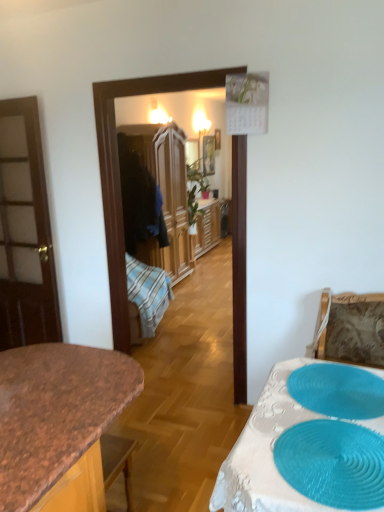
Question: Can you confirm if wooden wardrobe at center is smaller than granite countertop at center?

Choices:
 (A) yes
 (B) no

Answer: (B)

Question: From the image's perspective, would you say wooden wardrobe at center is shown under granite countertop at center?

Choices:
 (A) no
 (B) yes

Answer: (A)

Question: Does wooden wardrobe at center have a greater height compared to granite countertop at center?

Choices:
 (A) yes
 (B) no

Answer: (A)

Question: Considering the relative sizes of wooden wardrobe at center and granite countertop at center in the image provided, is wooden wardrobe at center thinner than granite countertop at center?

Choices:
 (A) yes
 (B) no

Answer: (A)

Question: Is wooden wardrobe at center behind granite countertop at center?

Choices:
 (A) yes
 (B) no

Answer: (A)

Question: Considering the positions of teal rubber placemat at lower right, which appears as the 1th oval when viewed from the front, and white lace tablecloth at lower right in the image, is teal rubber placemat at lower right, which appears as the 1th oval when viewed from the front, bigger or smaller than white lace tablecloth at lower right?

Choices:
 (A) small
 (B) big

Answer: (A)

Question: Is teal rubber placemat at lower right, arranged as the 2th oval when viewed from the back, in front of or behind white lace tablecloth at lower right in the image?

Choices:
 (A) behind
 (B) front

Answer: (A)

Question: From their relative heights in the image, would you say teal rubber placemat at lower right, which appears as the 1th oval when viewed from the front, is taller or shorter than white lace tablecloth at lower right?

Choices:
 (A) short
 (B) tall

Answer: (A)

Question: Is teal rubber placemat at lower right, which appears as the 1th oval when viewed from the front, wider or thinner than white lace tablecloth at lower right?

Choices:
 (A) thin
 (B) wide

Answer: (A)

Question: From a real-world perspective, relative to teal rubber placemat at lower right, arranged as the 2th oval when viewed from the back, is granite countertop at center vertically above or below?

Choices:
 (A) above
 (B) below

Answer: (B)

Question: Would you say granite countertop at center is inside or outside teal rubber placemat at lower right, arranged as the 2th oval when viewed from the back?

Choices:
 (A) outside
 (B) inside

Answer: (A)

Question: Is point (84, 440) positioned closer to the camera than point (360, 476)?

Choices:
 (A) farther
 (B) closer

Answer: (A)

Question: In terms of width, does granite countertop at center look wider or thinner when compared to teal rubber placemat at lower right, arranged as the 2th oval when viewed from the back?

Choices:
 (A) thin
 (B) wide

Answer: (B)

Question: Considering the positions of point (294, 477) and point (301, 386), is point (294, 477) closer or farther from the camera than point (301, 386)?

Choices:
 (A) closer
 (B) farther

Answer: (A)

Question: Is teal rubber placemat at lower right, which appears as the 1th oval when viewed from the front, in front of or behind blue textured placemat at lower right, which ranks as the first oval in back-to-front order, in the image?

Choices:
 (A) front
 (B) behind

Answer: (A)